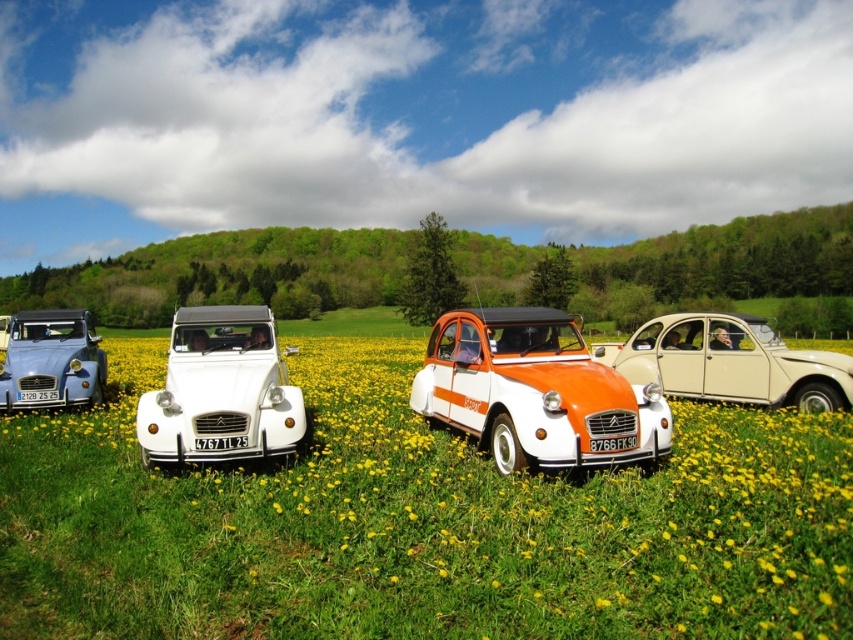
Question: Does beige matte car at center have a larger size compared to matte blue car at left?

Choices:
 (A) yes
 (B) no

Answer: (A)

Question: Is white matte citroën 2cv at center wider than matte blue car at left?

Choices:
 (A) no
 (B) yes

Answer: (B)

Question: Which of the following is the farthest from the observer?

Choices:
 (A) beige matte car at center
 (B) white matte citroën 2cv at center
 (C) orange matte car at center

Answer: (A)

Question: Which object is the farthest from the white matte citroën 2cv at center?

Choices:
 (A) orange matte car at center
 (B) beige matte car at center

Answer: (B)

Question: Is orange matte car at center positioned in front of white matte citroën 2cv at center?

Choices:
 (A) no
 (B) yes

Answer: (B)

Question: Considering the real-world distances, which object is farthest from the matte blue car at left?

Choices:
 (A) orange matte car at center
 (B) beige matte car at center
 (C) white matte citroën 2cv at center

Answer: (B)